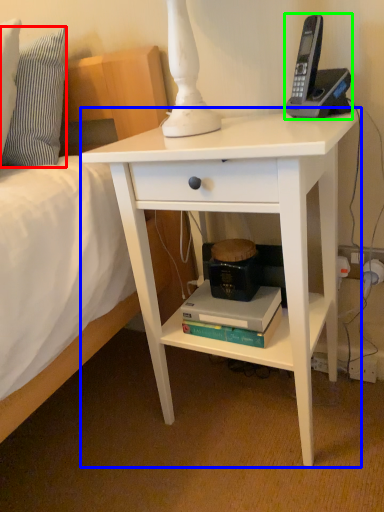
Question: Which object is the farthest from pillow (highlighted by a red box)? Choose among these: desk (highlighted by a blue box) or corded phone (highlighted by a green box).

Choices:
 (A) desk
 (B) corded phone

Answer: (B)